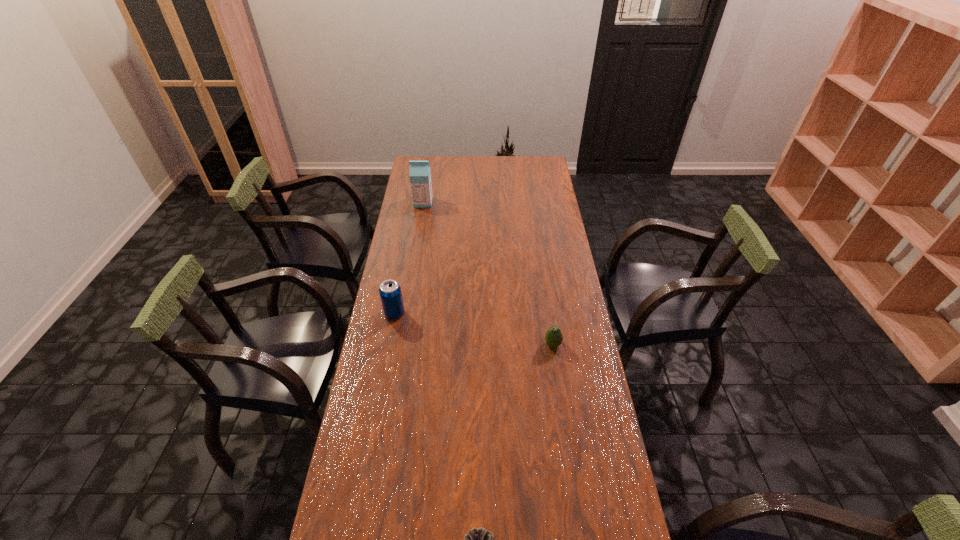
The image size is (960, 540). What are the coordinates of `pop soda located at the left edge` in the screenshot? It's located at (390, 292).

Locate an element on the screen. object positioned at the right edge is located at coordinates (553, 337).

In the image, there is a desktop. Find the location of `free space at the far edge`. free space at the far edge is located at coordinates (459, 173).

Identify the location of vacant space at the left edge of the desktop. The image size is (960, 540). (395, 370).

In the image, there is a desktop. Where is `blank space at the right edge`? blank space at the right edge is located at coordinates point(554,199).

Find the location of a particular element. Image resolution: width=960 pixels, height=540 pixels. free spot between the pop soda and the tallest object is located at coordinates (409, 258).

At what (x,y) coordinates should I click in order to perform the action: click on free space between the farthest object and the rightmost object. Please return your answer as a coordinate pair (x, y). This screenshot has width=960, height=540. Looking at the image, I should click on (488, 273).

At what (x,y) coordinates should I click in order to perform the action: click on free point between the farthest object and the third farthest object. Please return your answer as a coordinate pair (x, y). The height and width of the screenshot is (540, 960). Looking at the image, I should click on (488, 273).

Locate an element on the screen. This screenshot has width=960, height=540. free point between the rightmost object and the pop soda is located at coordinates (473, 329).

Where is `blank region between the farthest object and the avocado`? blank region between the farthest object and the avocado is located at coordinates (488, 273).